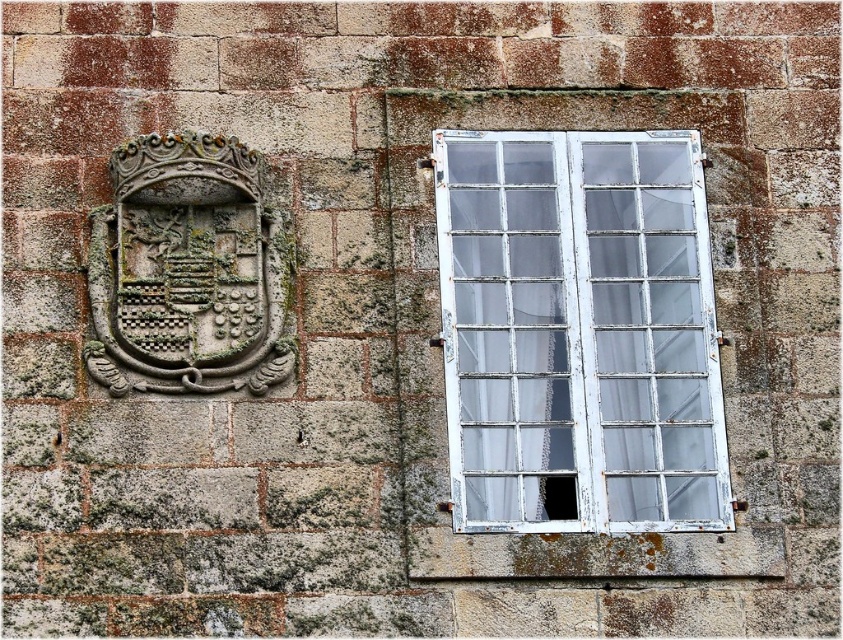
You are standing in front of the stone wall and want to locate the white painted wood window at right. According to the coordinates provided, where would you look to find it?

The white painted wood window at right is located at the 2D coordinates point (578, 330) on the image.

You are an architect examining the stone wall. You notice the white painted wood window at right and the carved stone coat of arms at upper left. Which object is located lower on the wall?

The white painted wood window at right is positioned under the carved stone coat of arms at upper left, so it is located lower on the wall.

You are standing in front of the stone wall and want to touch both points on the wall. Which point would you need to reach out further to touch, point at [494,232] or point at [213,198]?

Point at [494,232] is further to the camera than point at [213,198], so you would need to reach out further to touch point at [213,198] because it is closer to you.